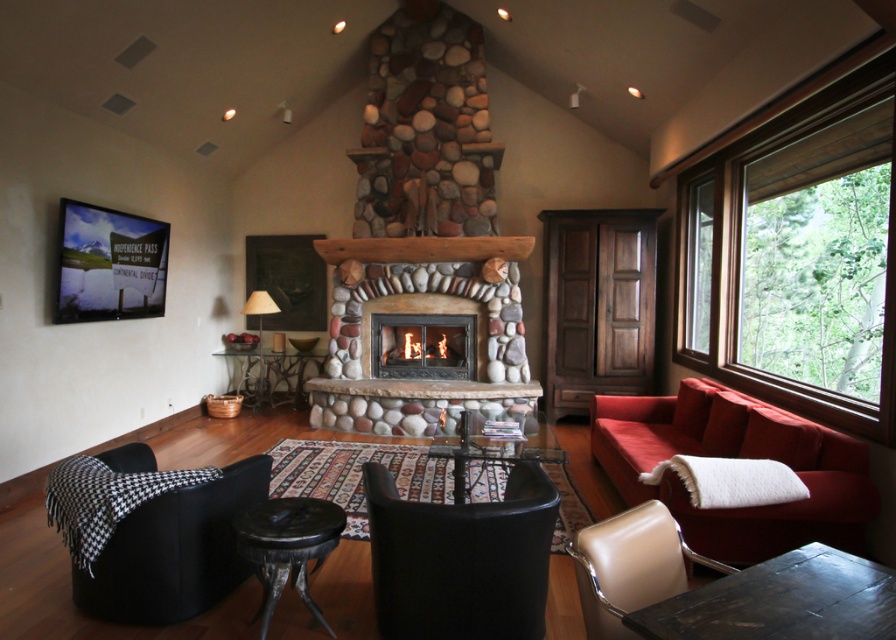
Describe the element at coordinates (798, 257) in the screenshot. The image size is (896, 640). I see `wooden frame at right` at that location.

Which is above, wooden frame at right or black leather armchair at left?

wooden frame at right is higher up.

Identify the location of wooden frame at right. (798, 257).

Can you confirm if black leather armchair at center is shorter than rustic stone fireplace at center?

Correct, black leather armchair at center is not as tall as rustic stone fireplace at center.

Does black leather armchair at center appear over rustic stone fireplace at center?

Actually, black leather armchair at center is below rustic stone fireplace at center.

This screenshot has height=640, width=896. What do you see at coordinates (461, 560) in the screenshot?
I see `black leather armchair at center` at bounding box center [461, 560].

The image size is (896, 640). What are the coordinates of `black leather armchair at center` in the screenshot? It's located at (461, 560).

Is natural stone fireplace at center positioned in front of velvet red couch at right?

No, it is not.

Which is behind, point (332, 323) or point (617, 452)?

Positioned behind is point (332, 323).

Find the location of a particular element. This screenshot has width=896, height=640. natural stone fireplace at center is located at coordinates (423, 333).